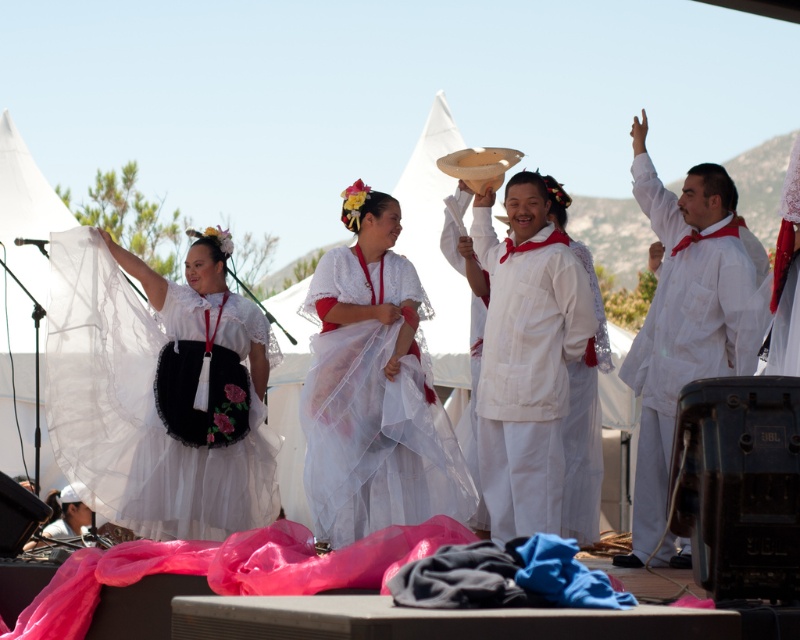
Which is in front, point (160, 452) or point (725, 296)?

Point (725, 296)

Is white sheer skirt at left shorter than white sheer robe at right?

Correct, white sheer skirt at left is not as tall as white sheer robe at right.

Image resolution: width=800 pixels, height=640 pixels. What are the coordinates of `white sheer skirt at left` in the screenshot? It's located at (160, 390).

Does white sheer skirt at left have a lesser width compared to white cotton dress at center?

Incorrect, white sheer skirt at left's width is not less than white cotton dress at center's.

Which is more to the right, white sheer skirt at left or white cotton dress at center?

From the viewer's perspective, white cotton dress at center appears more on the right side.

Find the location of a particular element. The width and height of the screenshot is (800, 640). white sheer skirt at left is located at coordinates (160, 390).

This screenshot has width=800, height=640. Find the location of `white sheer skirt at left`. white sheer skirt at left is located at coordinates (160, 390).

Can you confirm if white cotton dress at center is positioned below white sheer robe at right?

Yes.

Can you confirm if white cotton dress at center is wider than white sheer robe at right?

No.

This screenshot has height=640, width=800. Describe the element at coordinates (526, 355) in the screenshot. I see `white cotton dress at center` at that location.

Find the location of a particular element. This screenshot has height=640, width=800. white cotton dress at center is located at coordinates (526, 355).